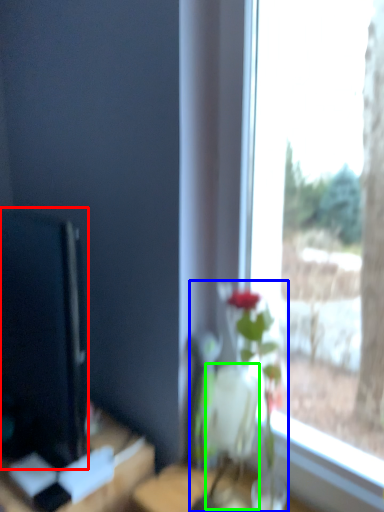
Question: Considering the real-world distances, which object is closest to computer monitor (highlighted by a red box)? houseplant (highlighted by a blue box) or vase (highlighted by a green box).

Choices:
 (A) houseplant
 (B) vase

Answer: (A)